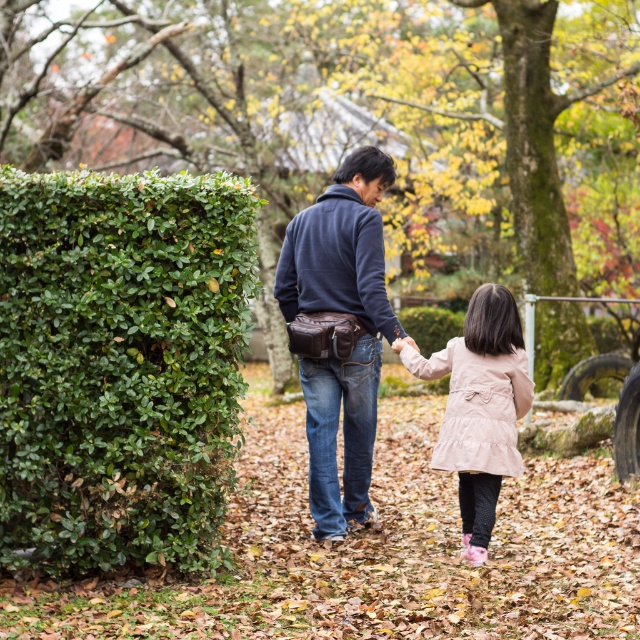
You are a gardener planning to place a new decorative statue in the garden. The statue requires a space that is wider than the pale pink suede coat at center. Can the green leafy hedge at left accommodate this statue? Please explain based on their widths.

The green leafy hedge at left might be wider than the pale pink suede coat at center, so it could potentially accommodate the statue if the hedge is indeed wider. However, the exact width isn not specified, so further measurement would be needed to confirm.

You are standing at point (477, 552) and want to walk to point (36, 205). Which direction should you move?

You should move forward because point (36, 205) is in front of point (477, 552).

Based on the scene description, where is the green leafy hedge at left located in the image?

The green leafy hedge at left is located at point (120, 364) in the image.